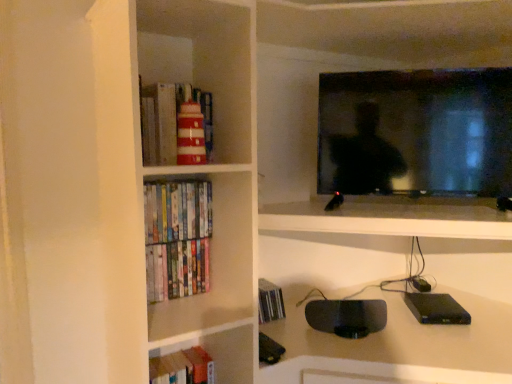
Question: Is black glossy tv at upper right facing away from hardcover books at lower left?

Choices:
 (A) no
 (B) yes

Answer: (A)

Question: Is black glossy tv at upper right further to camera compared to hardcover books at lower left?

Choices:
 (A) yes
 (B) no

Answer: (B)

Question: Is black glossy tv at upper right thinner than hardcover books at lower left?

Choices:
 (A) no
 (B) yes

Answer: (A)

Question: Does black glossy tv at upper right turn towards hardcover books at lower left?

Choices:
 (A) no
 (B) yes

Answer: (A)

Question: Can you confirm if black glossy tv at upper right is wider than hardcover books at lower left?

Choices:
 (A) yes
 (B) no

Answer: (A)

Question: Is black glossy tv at upper right outside of hardcover books at lower left?

Choices:
 (A) no
 (B) yes

Answer: (B)

Question: Is hardcover books at left far from hardcover books at lower left?

Choices:
 (A) no
 (B) yes

Answer: (A)

Question: Can you confirm if hardcover books at left is bigger than hardcover books at lower left?

Choices:
 (A) no
 (B) yes

Answer: (A)

Question: Does hardcover books at left have a lesser width compared to hardcover books at lower left?

Choices:
 (A) no
 (B) yes

Answer: (B)

Question: From a real-world perspective, is hardcover books at left below hardcover books at lower left?

Choices:
 (A) yes
 (B) no

Answer: (B)

Question: From a real-world perspective, is hardcover books at left located higher than hardcover books at lower left?

Choices:
 (A) no
 (B) yes

Answer: (B)

Question: Can you confirm if hardcover books at left is wider than hardcover books at lower left?

Choices:
 (A) yes
 (B) no

Answer: (B)

Question: Does hardcover books at left lie in front of black glossy tv at upper right?

Choices:
 (A) no
 (B) yes

Answer: (A)